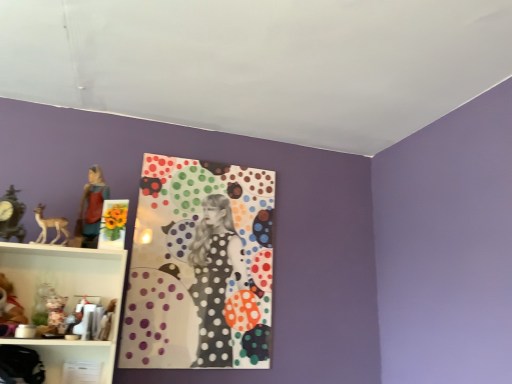
Measure the distance between plush teddy bear at lower left and camera.

plush teddy bear at lower left and camera are 1.65 meters apart.

You are a GUI agent. You are given a task and a screenshot of the screen. Output one action in this format:
    pyautogui.click(x=<x>, y=<y>)
    Task: Click on the matte brown statue at left
    The width and height of the screenshot is (512, 384).
    Given the screenshot: What is the action you would take?
    pyautogui.click(x=92, y=207)

Relative to matte black bag at lower left, is matte brown deer at left in front or behind?

matte brown deer at left is behind matte black bag at lower left.

Can you confirm if matte brown deer at left is thinner than matte black bag at lower left?

Indeed, matte brown deer at left has a lesser width compared to matte black bag at lower left.

Is matte brown deer at left bigger than matte black bag at lower left?

Actually, matte brown deer at left might be smaller than matte black bag at lower left.

Can you confirm if matte brown deer at left is taller than matte black bag at lower left?

Indeed, matte brown deer at left has a greater height compared to matte black bag at lower left.

From a real-world perspective, which object rests below the other?

From a 3D spatial view, plush teddy bear at lower left is below.

Is matte brown statue at left behind plush teddy bear at lower left?

Yes, it is.

Is matte brown statue at left bigger or smaller than plush teddy bear at lower left?

In the image, matte brown statue at left appears to be smaller than plush teddy bear at lower left.

From the image's perspective, which is below, matte black bag at lower left or matte brown deer at left?

matte black bag at lower left appears lower in the image.

Are matte black bag at lower left and matte brown deer at left far apart?

No, matte black bag at lower left is in close proximity to matte brown deer at left.

Is matte black bag at lower left outside of matte brown deer at left?

Yes, matte black bag at lower left is outside of matte brown deer at left.

Could you tell me if matte black bag at lower left is facing matte brown deer at left?

Result: No, matte black bag at lower left does not turn towards matte brown deer at left.

What's the angular difference between matte black bag at lower left and plush teddy bear at lower left's facing directions?

matte black bag at lower left and plush teddy bear at lower left are facing 1.41 degrees away from each other.

In the scene shown: Between matte black bag at lower left and plush teddy bear at lower left, which one is positioned behind?

plush teddy bear at lower left is further away from the camera.

Choose the correct answer: Is matte black bag at lower left inside plush teddy bear at lower left or outside it?

matte black bag at lower left lies outside plush teddy bear at lower left.

Is matte black bag at lower left oriented away from plush teddy bear at lower left?

No, matte black bag at lower left is not facing away from plush teddy bear at lower left.

Is matte black clock at left turned away from polka dot fabric at center?

No, matte black clock at left is not facing the opposite direction of polka dot fabric at center.

Does matte black clock at left appear on the right side of polka dot fabric at center?

In fact, matte black clock at left is to the left of polka dot fabric at center.

The width and height of the screenshot is (512, 384). In order to click on design to the right of matte black clock at left in this screenshot , I will do `click(200, 267)`.

Which is further, (10, 207) or (243, 284)?

The point (243, 284) is more distant.

Are matte brown statue at left and polka dot fabric at center far apart?

Actually, matte brown statue at left and polka dot fabric at center are a little close together.

Locate an element on the screen. The image size is (512, 384). design directly beneath the matte brown statue at left (from a real-world perspective) is located at coordinates (200, 267).

Is matte brown statue at left positioned with its back to polka dot fabric at center?

No, matte brown statue at left is not facing away from polka dot fabric at center.

Does point (95, 202) lie in front of point (214, 242)?

Yes.

Considering the sizes of matte black bag at lower left and matte brown statue at left in the image, is matte black bag at lower left bigger or smaller than matte brown statue at left?

Considering their sizes, matte black bag at lower left takes up more space than matte brown statue at left.

Is matte black bag at lower left looking in the opposite direction of matte brown statue at left?

No, matte black bag at lower left is not facing away from matte brown statue at left.

Is matte black bag at lower left in front of matte brown statue at left?

Yes, matte black bag at lower left is in front of matte brown statue at left.

Is matte black bag at lower left taller than matte brown statue at left?

In fact, matte black bag at lower left may be shorter than matte brown statue at left.

The image size is (512, 384). I want to click on animal on the right of matte black bag at lower left, so click(x=50, y=226).

The height and width of the screenshot is (384, 512). In order to click on person that is behind the plush teddy bear at lower left in this screenshot , I will do `click(92, 207)`.

Looking at the image, which one is located closer to matte black clock at left, polka dot fabric at center or matte black bag at lower left?

matte black bag at lower left.

From the image, which object appears to be nearer to matte brown deer at left, plush teddy bear at lower left or matte brown statue at left?

matte brown statue at left is closer to matte brown deer at left.

From the image, which object appears to be nearer to matte black clock at left, matte brown statue at left or matte brown deer at left?

matte brown deer at left lies closer to matte black clock at left than the other object.

Looking at the image, which one is located further to matte brown deer at left, matte black clock at left or matte brown statue at left?

matte black clock at left is further to matte brown deer at left.

Considering their positions, is matte brown deer at left positioned closer to plush teddy bear at lower left than matte black bag at lower left?

Based on the image, matte black bag at lower left appears to be nearer to plush teddy bear at lower left.

Looking at the image, which one is located closer to polka dot fabric at center, plush teddy bear at lower left or matte brown statue at left?

matte brown statue at left lies closer to polka dot fabric at center than the other object.

Looking at this image, considering their positions, is matte brown deer at left positioned closer to polka dot fabric at center than plush teddy bear at lower left?

Among the two, matte brown deer at left is located nearer to polka dot fabric at center.

When comparing their distances from matte brown deer at left, does matte black bag at lower left or matte black clock at left seem further?

Based on the image, matte black bag at lower left appears to be further to matte brown deer at left.

Image resolution: width=512 pixels, height=384 pixels. I want to click on toy between matte brown statue at left and matte black bag at lower left from top to bottom, so (x=9, y=308).

This screenshot has width=512, height=384. I want to click on toy between matte black clock at left and polka dot fabric at center, so click(9, 308).

Locate an element on the screen. toy that lies between matte brown deer at left and matte black bag at lower left from top to bottom is located at coordinates (9, 308).

The width and height of the screenshot is (512, 384). Identify the location of animal between matte black clock at left and matte black bag at lower left in the up-down direction. (50, 226).